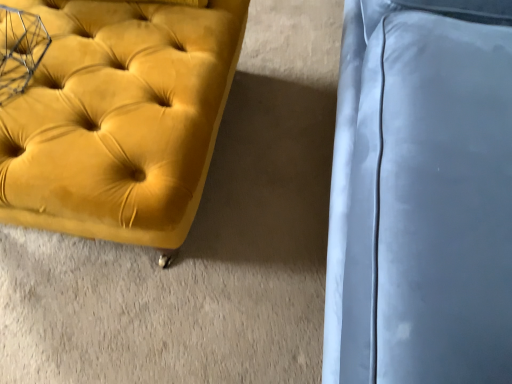
Question: Considering the positions of satin blue cushion at right and velvet yellow ottoman at left in the image, is satin blue cushion at right taller or shorter than velvet yellow ottoman at left?

Choices:
 (A) short
 (B) tall

Answer: (B)

Question: Choose the correct answer: Is satin blue cushion at right inside velvet yellow ottoman at left or outside it?

Choices:
 (A) inside
 (B) outside

Answer: (B)

Question: From a real-world perspective, is satin blue cushion at right above or below velvet yellow ottoman at left?

Choices:
 (A) above
 (B) below

Answer: (A)

Question: Does point [x=99, y=142] appear closer or farther from the camera than point [x=360, y=44]?

Choices:
 (A) farther
 (B) closer

Answer: (B)

Question: Based on their sizes in the image, would you say velvet yellow ottoman at left is bigger or smaller than satin blue cushion at right?

Choices:
 (A) small
 (B) big

Answer: (A)

Question: Which is correct: velvet yellow ottoman at left is inside satin blue cushion at right, or outside of it?

Choices:
 (A) inside
 (B) outside

Answer: (B)

Question: From a real-world perspective, is velvet yellow ottoman at left above or below satin blue cushion at right?

Choices:
 (A) below
 (B) above

Answer: (A)